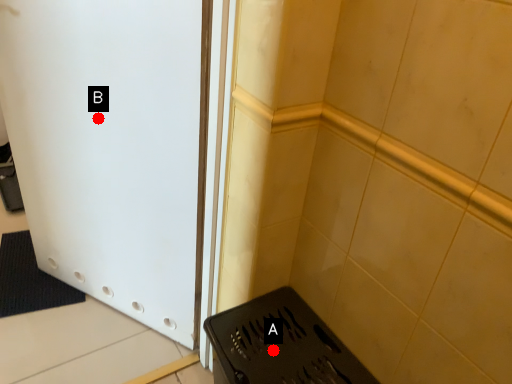
Question: Two points are circled on the image, labeled by A and B beside each circle. Which point appears farthest from the camera in this image?

Choices:
 (A) A is further
 (B) B is further

Answer: (B)